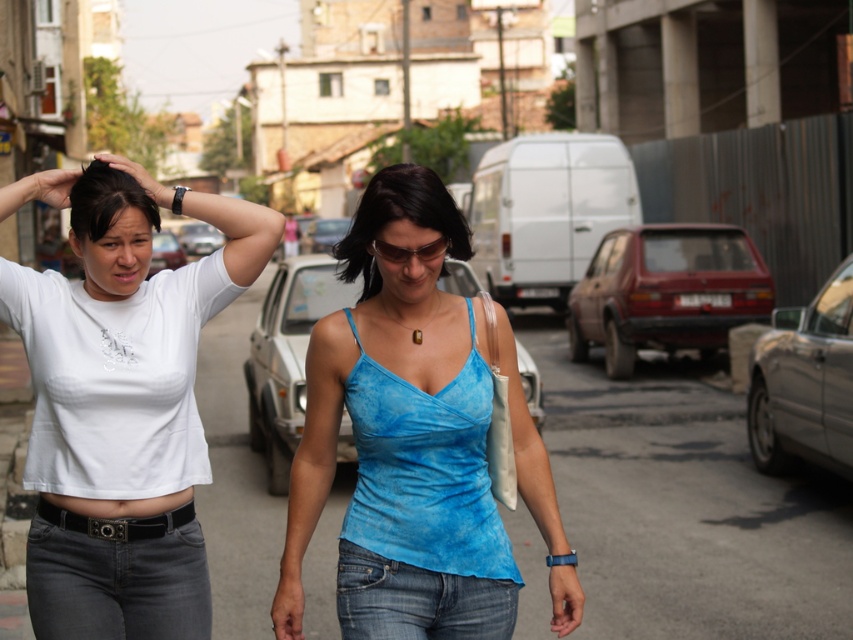
Question: Is denim jeans at lower left to the left of matte black hand at upper left from the viewer's perspective?

Choices:
 (A) yes
 (B) no

Answer: (B)

Question: Which object is the farthest from the matte black hand at upper left?

Choices:
 (A) matte black watch at upper center
 (B) dark brown shiny hair at upper left
 (C) blue fabric top at center
 (D) denim jeans at center

Answer: (A)

Question: Considering the relative positions of blue fabric top at center and dark brown shiny hair at upper left in the image provided, where is blue fabric top at center located with respect to dark brown shiny hair at upper left?

Choices:
 (A) right
 (B) left

Answer: (A)

Question: Which of the following is the farthest from the observer?

Choices:
 (A) matte black watch at upper center
 (B) dark brown shiny hair at upper left
 (C) white matte t-shirt at left
 (D) denim jeans at center

Answer: (A)

Question: Does white matte t-shirt at left have a greater width compared to matte black hand at upper left?

Choices:
 (A) yes
 (B) no

Answer: (A)

Question: Which point appears farthest from the camera in this image?

Choices:
 (A) (469, 253)
 (B) (57, 572)
 (C) (151, 179)

Answer: (C)